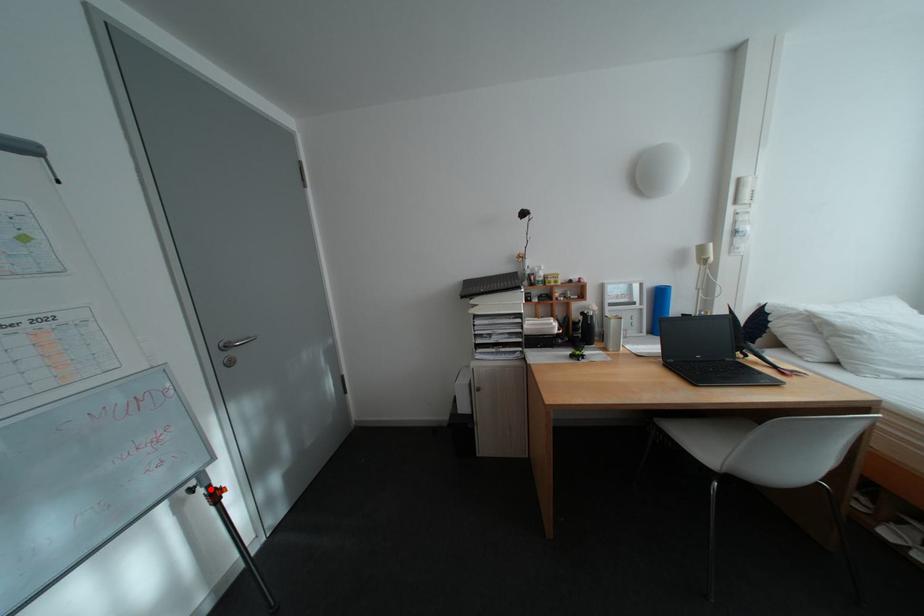
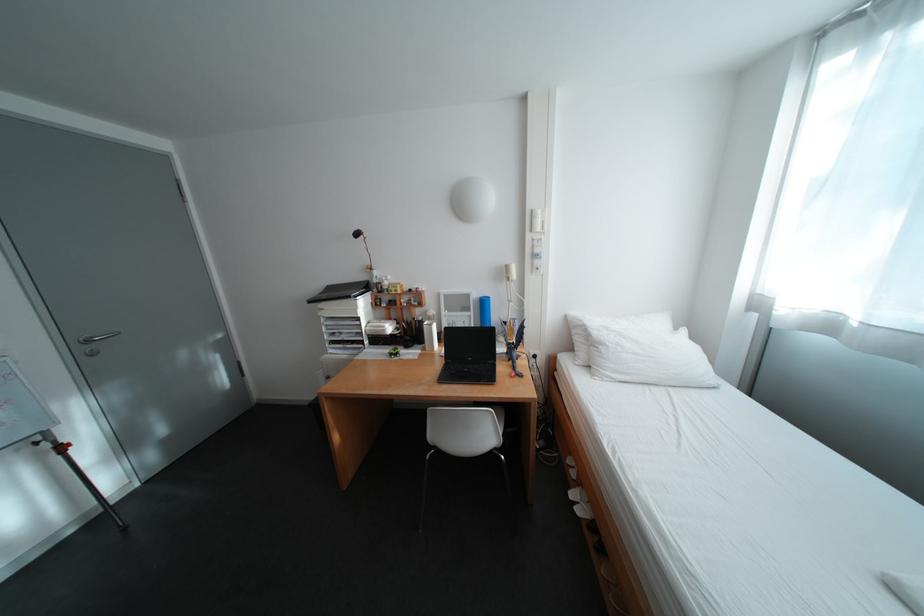
Question: I am providing you with two images of the same scene from different viewpoints. In image1, a red point is highlighted. Considering the same 3D point in image2, which of the following is correct?

Choices:
 (A) It is closer
 (B) It is farther

Answer: (B)